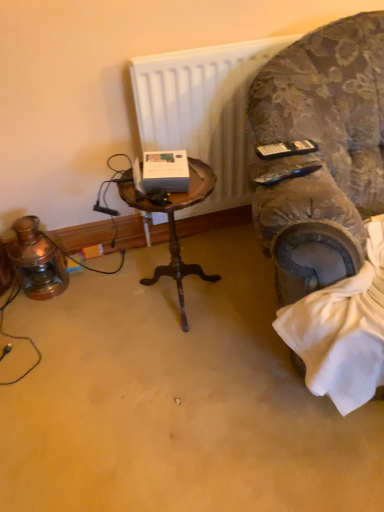
Identify the location of vacant position to the left of woodenobject at center. pyautogui.click(x=103, y=310).